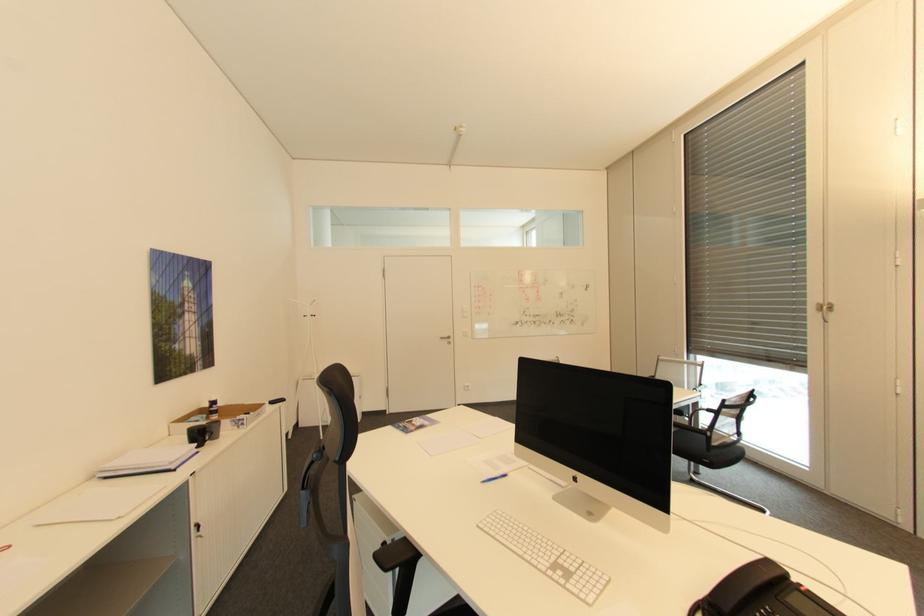
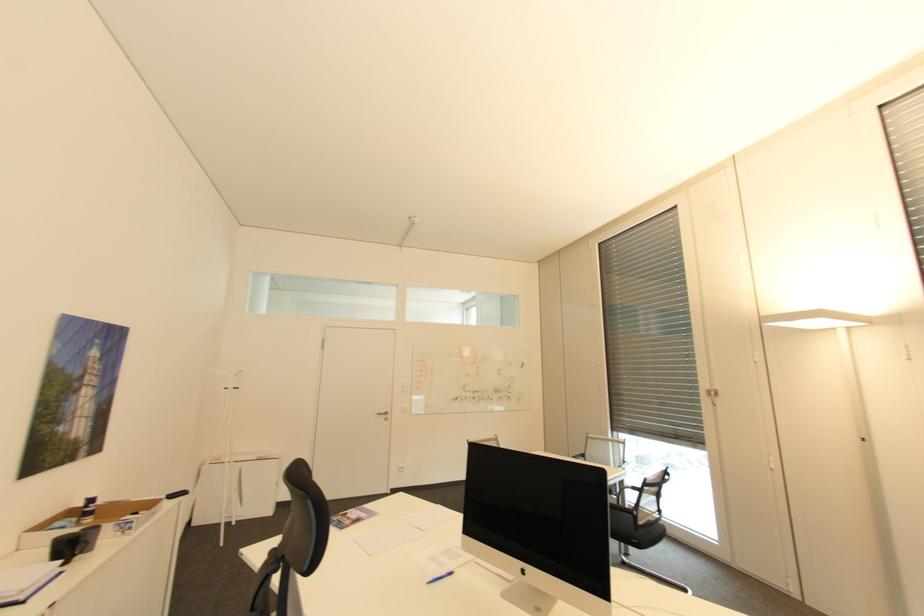
Which direction would the cameraman need to move to produce the second image?

The cameraman walked toward left, backward.